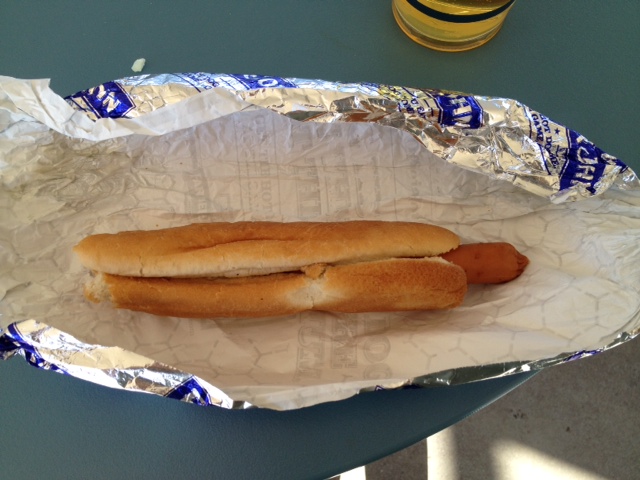
Identify the location of floor. (72, 399).